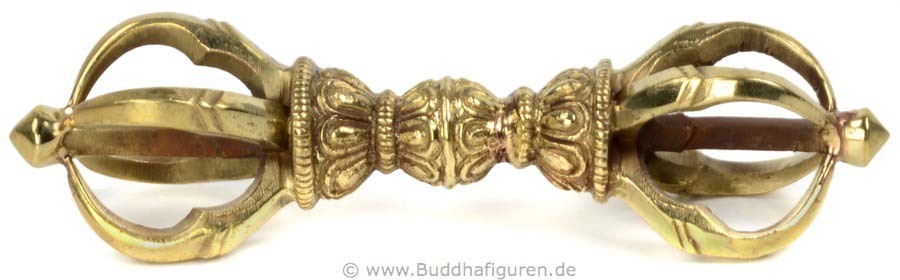
Find the location of a particular element. This screenshot has width=900, height=280. floral decoration is located at coordinates (337, 137).